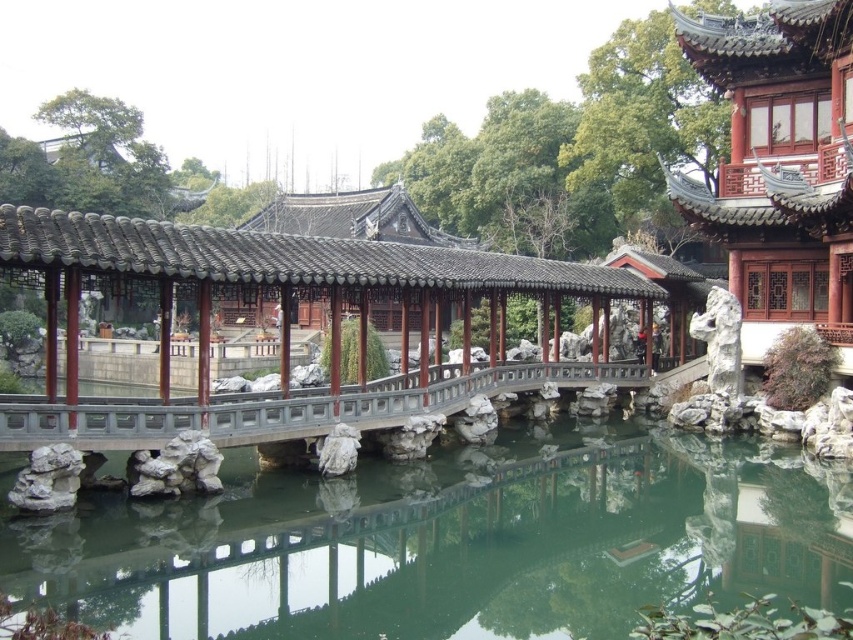
You are a visitor standing at the entrance of the garden and want to walk to the farther point between point (x=276, y=602) and point (x=134, y=436). Which point should you head towards?

Point (x=134, y=436) is farther from the viewer than point (x=276, y=602), so you should head towards point (x=134, y=436).

You are a visitor in the garden and want to take a photo of the wooden bridge at center and the smooth gray stone bridge at center. Which bridge should you stand closer to in order to capture both bridges in the same frame without needing to zoom in too much?

The wooden bridge at center is much taller than the smooth gray stone bridge at center. To capture both bridges in the same frame without excessive zoom, you should stand closer to the taller wooden bridge at center so that the height difference is minimized in the photo.